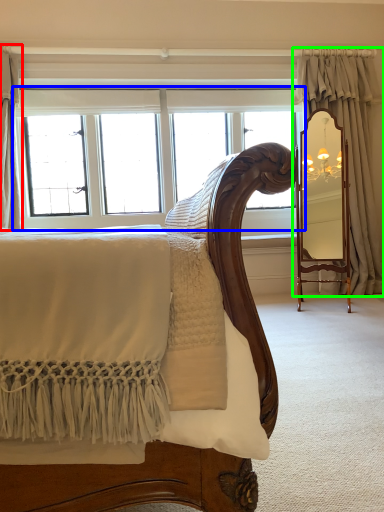
Question: Which is nearer to the curtain (highlighted by a red box)? window (highlighted by a blue box) or curtain (highlighted by a green box).

Choices:
 (A) window
 (B) curtain

Answer: (A)